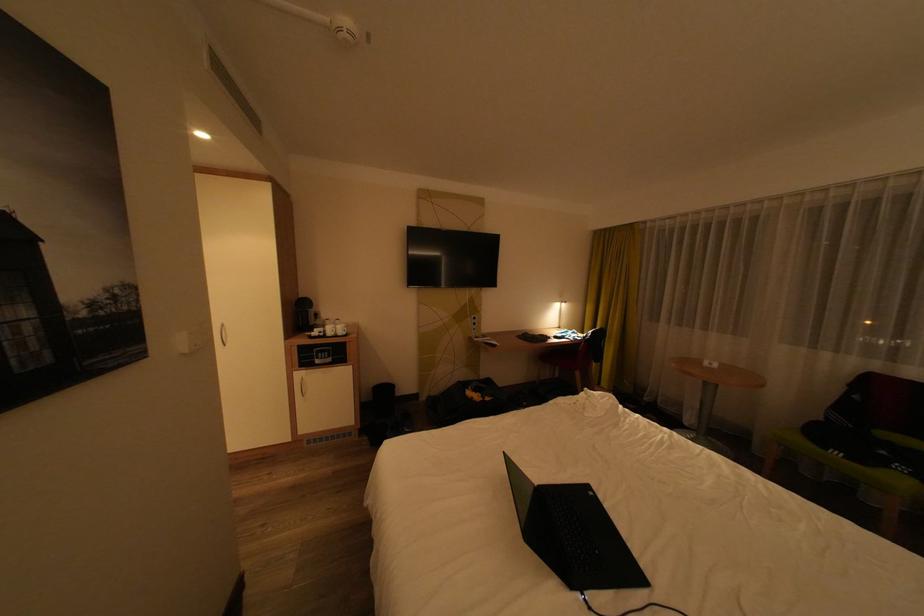
Where would you sit the green chair sitting surface? Please return your answer as a coordinate pair (x, y).

(850, 464)